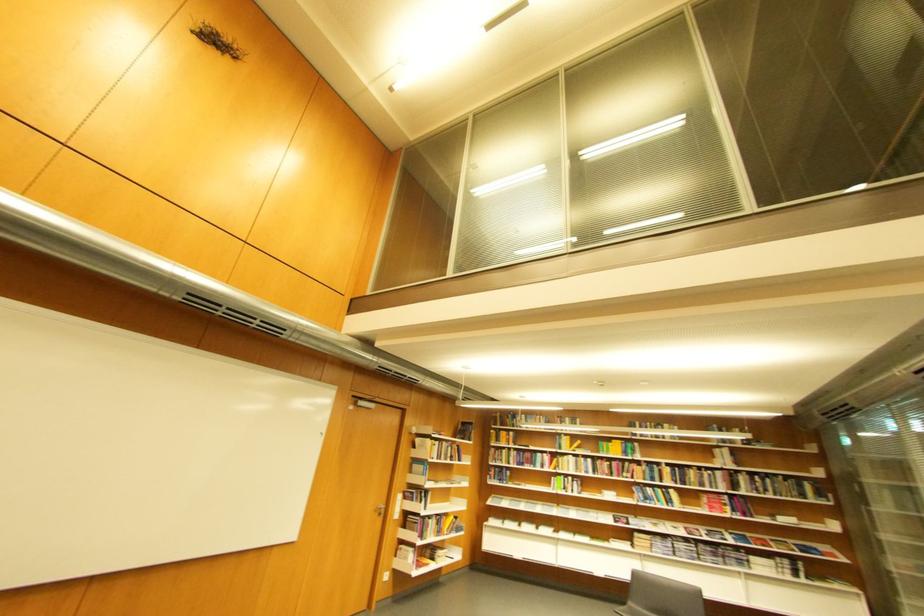
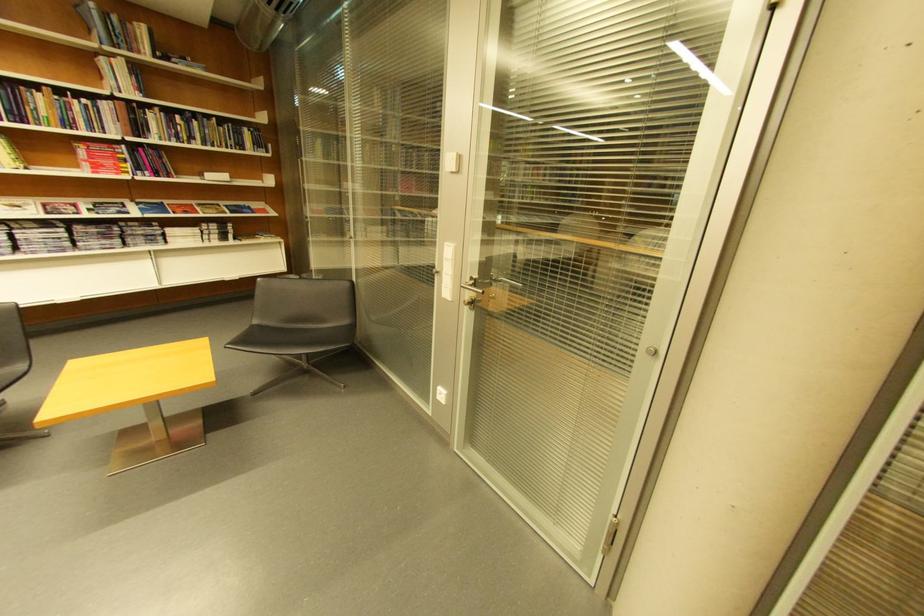
Where in the second image is the point corresponding to [727,452] from the first image?

(113, 62)